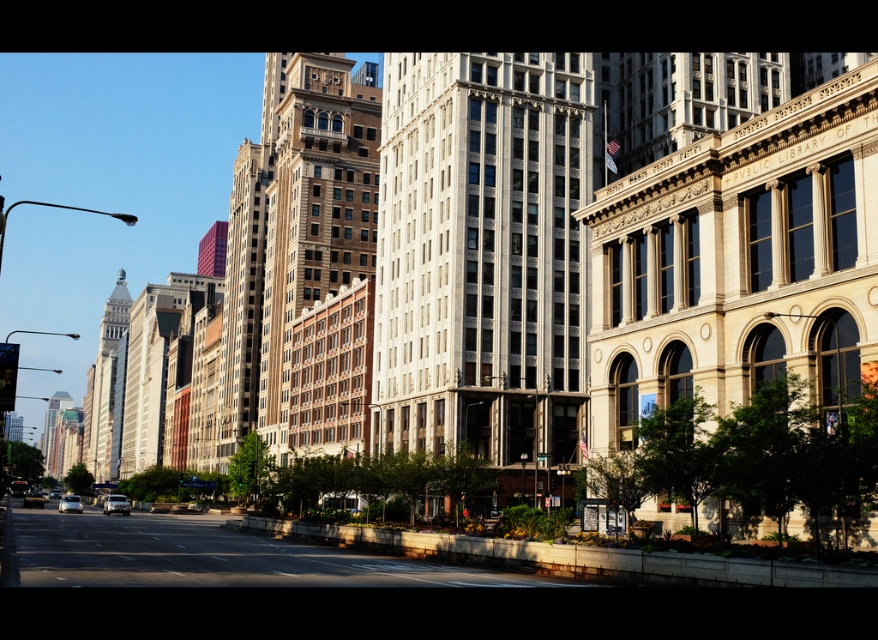
Is silver metallic car at lower left thinner than metallic silver sedan at lower left?

Yes.

How distant is silver metallic car at lower left from metallic silver sedan at lower left?

silver metallic car at lower left is 4.83 meters from metallic silver sedan at lower left.

The image size is (878, 640). In order to click on silver metallic car at lower left in this screenshot , I will do `click(116, 504)`.

Can you confirm if metallic silver sedan at lower left is positioned to the left of shiny silver car at lower left?

No, metallic silver sedan at lower left is not to the left of shiny silver car at lower left.

Between metallic silver sedan at lower left and shiny silver car at lower left, which one is positioned higher?

metallic silver sedan at lower left

Which is in front, point (68, 493) or point (32, 490)?

Point (68, 493) is more forward.

At what (x,y) coordinates should I click in order to perform the action: click on metallic silver sedan at lower left. Please return your answer as a coordinate pair (x, y). The width and height of the screenshot is (878, 640). Looking at the image, I should click on (70, 502).

Does silver metallic car at lower left lie in front of shiny silver car at lower left?

Yes, it is in front of shiny silver car at lower left.

Does silver metallic car at lower left have a lesser width compared to shiny silver car at lower left?

Yes, silver metallic car at lower left is thinner than shiny silver car at lower left.

Who is more forward, [110,509] or [42,502]?

Positioned in front is point [110,509].

I want to click on silver metallic car at lower left, so click(x=116, y=504).